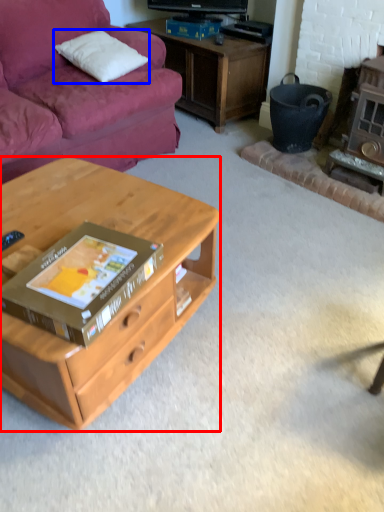
Question: Which object is closer to the camera taking this photo, desk (highlighted by a red box) or pillow (highlighted by a blue box)?

Choices:
 (A) desk
 (B) pillow

Answer: (A)